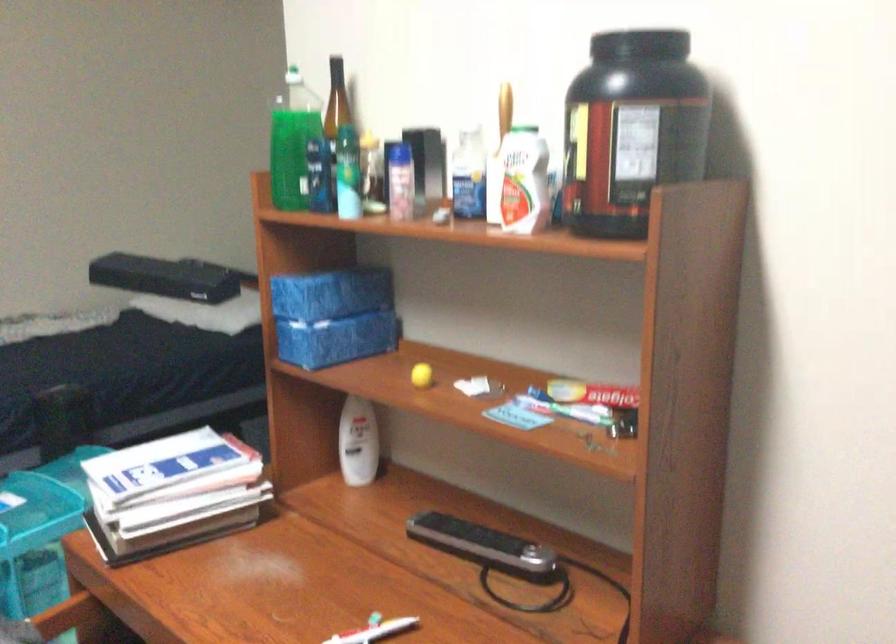
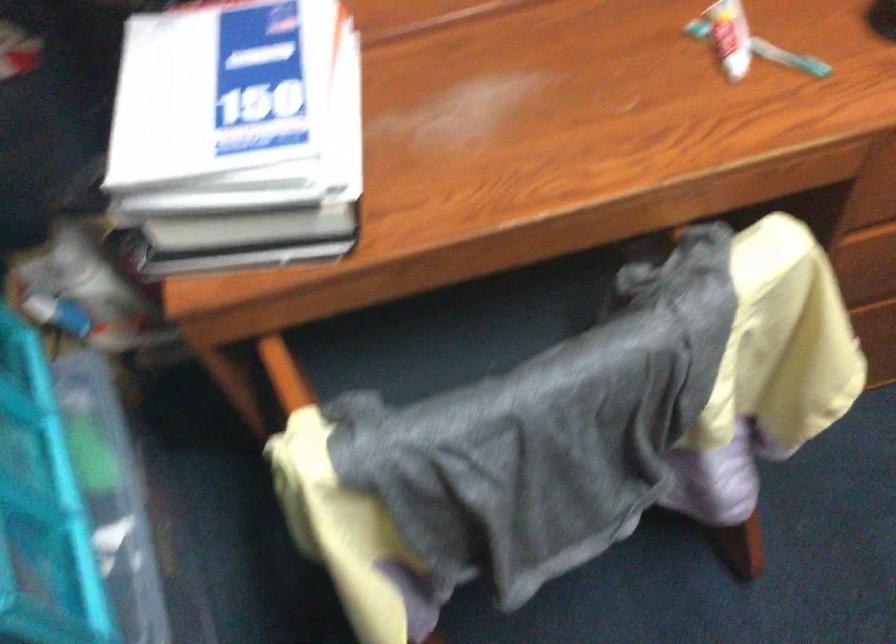
In the second image, find the point that corresponds to point 125,475 in the first image.

(237, 128)